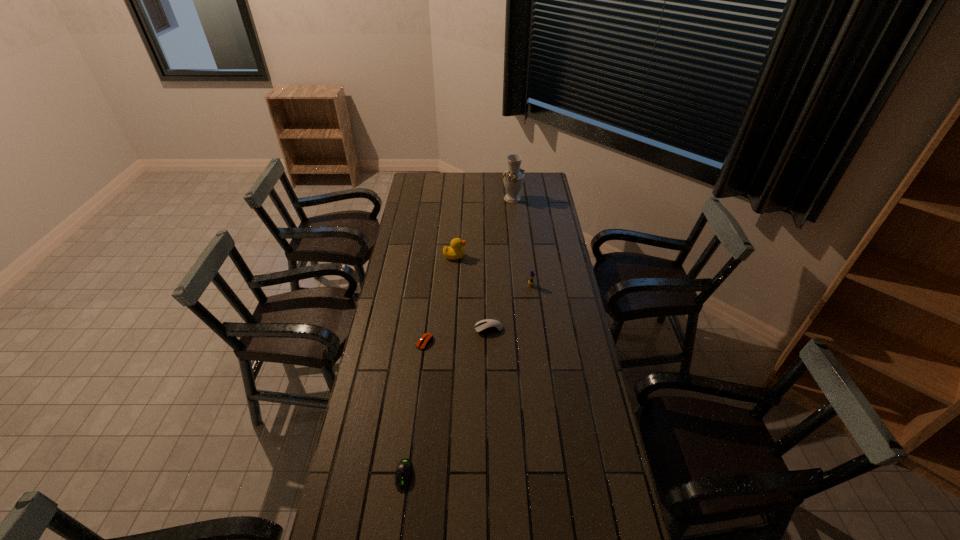
Locate an element on the screen. free space that is in between the second tallest object and the tallest object is located at coordinates (484, 227).

At what (x,y) coordinates should I click in order to perform the action: click on free space that is in between the third object from right to left and the second shortest computer mouse. Please return your answer as a coordinate pair (x, y). This screenshot has height=540, width=960. Looking at the image, I should click on (446, 402).

Where is `the fourth closest object to the third object from left to right`? The image size is (960, 540). the fourth closest object to the third object from left to right is located at coordinates click(x=426, y=339).

Identify which object is located as the third nearest to the rightmost computer mouse. Please provide its 2D coordinates. Your answer should be formatted as a tuple, i.e. [(x, y)], where the tuple contains the x and y coordinates of a point satisfying the conditions above.

[(455, 251)]

Locate which computer mouse is the third closest to the farthest object. Please provide its 2D coordinates. Your answer should be formatted as a tuple, i.e. [(x, y)], where the tuple contains the x and y coordinates of a point satisfying the conditions above.

[(404, 471)]

Select which computer mouse is the closest to the shortest computer mouse. Please provide its 2D coordinates. Your answer should be formatted as a tuple, i.e. [(x, y)], where the tuple contains the x and y coordinates of a point satisfying the conditions above.

[(488, 325)]

This screenshot has height=540, width=960. What are the coordinates of `vacant region that satisfies the following two spatial constraints: 1. at the beak of the rightmost computer mouse; 2. on the left side of the fourth object from right to left` in the screenshot? It's located at (450, 329).

I want to click on free spot that satisfies the following two spatial constraints: 1. at the beak of the third object from left to right; 2. on the left side of the third object from right to left, so click(450, 329).

The height and width of the screenshot is (540, 960). Identify the location of vacant space that satisfies the following two spatial constraints: 1. at the beak of the fifth nearest object; 2. on the right side of the rightmost computer mouse. (450, 329).